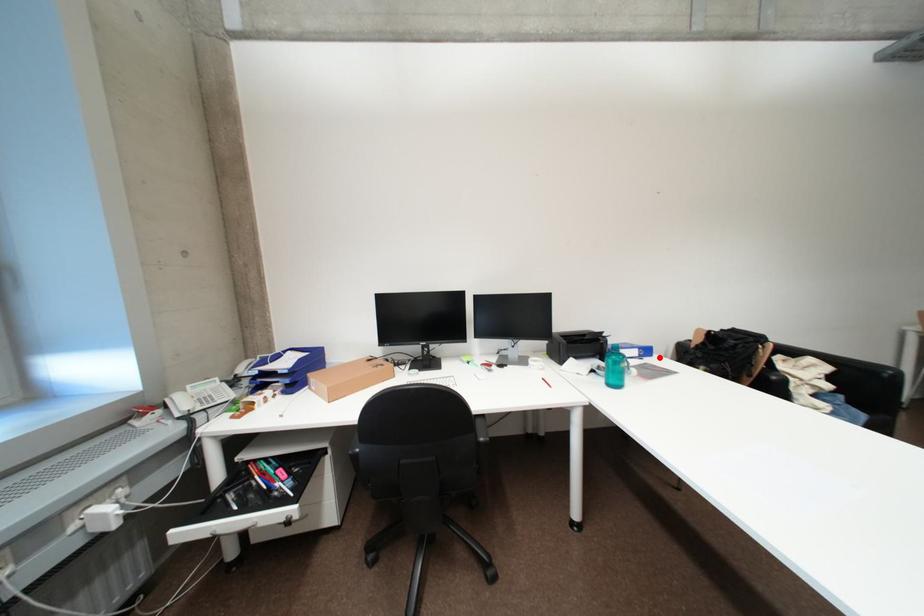
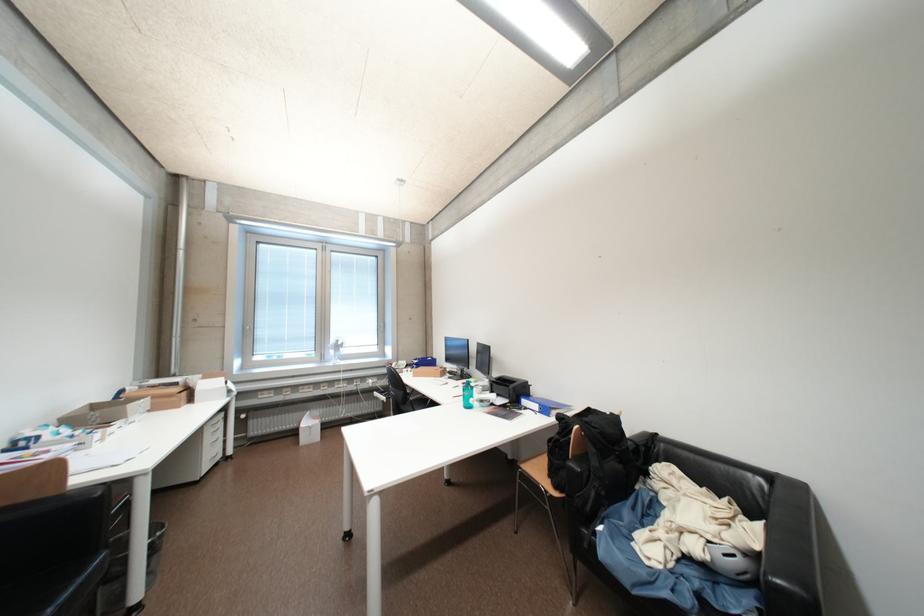
The point at the highlighted location is marked in the first image. Where is the corresponding point in the second image?

(555, 418)